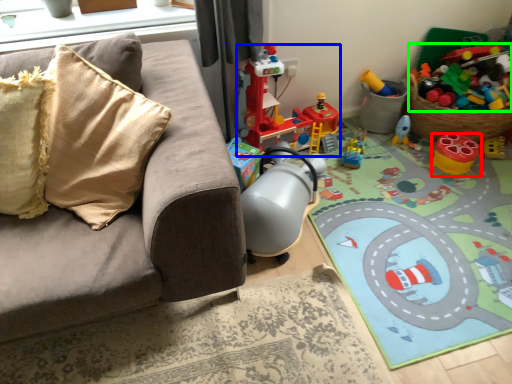
Question: Which object is the closest to the toy (highlighted by a red box)? Choose among these: toy (highlighted by a blue box) or toy (highlighted by a green box).

Choices:
 (A) toy
 (B) toy

Answer: (B)